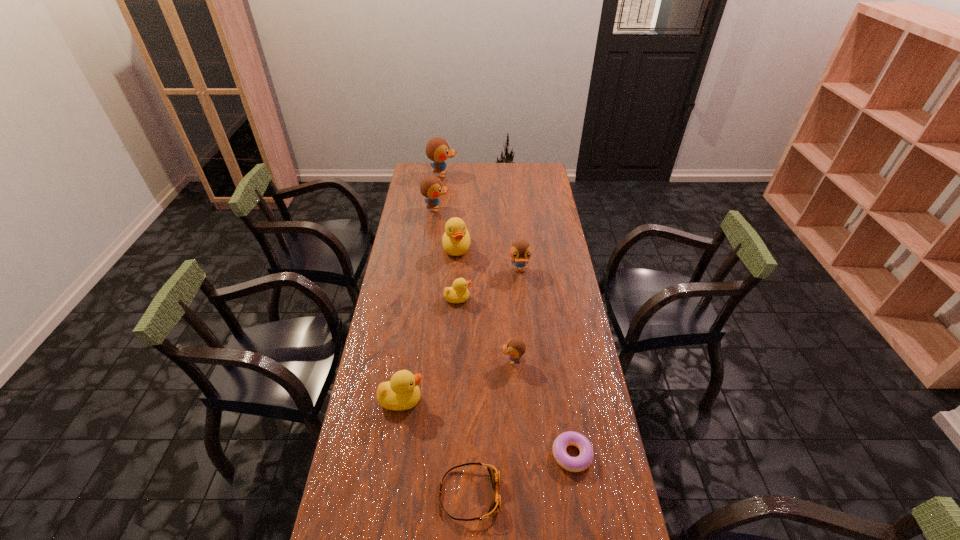
Find the location of a particular element. The image size is (960, 540). free space in the image that satisfies the following two spatial constraints: 1. on the front-facing side of the second smallest blue duck; 2. with the lenses facing forward on the eighth tallest object is located at coordinates (541, 494).

Identify the location of vacant space that satisfies the following two spatial constraints: 1. on the front-facing side of the second biggest blue duck; 2. on the left side of the shortest object. (405, 454).